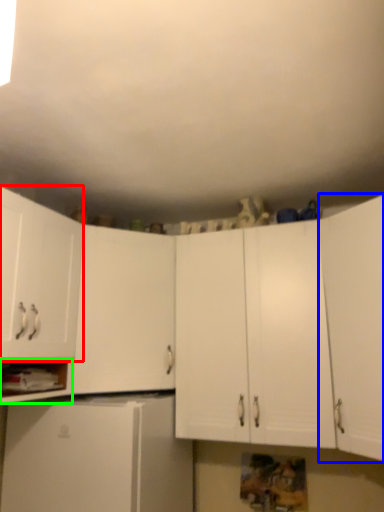
Question: Estimate the real-world distances between objects in this image. Which object is closer to cabinetry (highlighted by a red box), cabinetry (highlighted by a blue box) or cabinet (highlighted by a green box)?

Choices:
 (A) cabinetry
 (B) cabinet

Answer: (B)